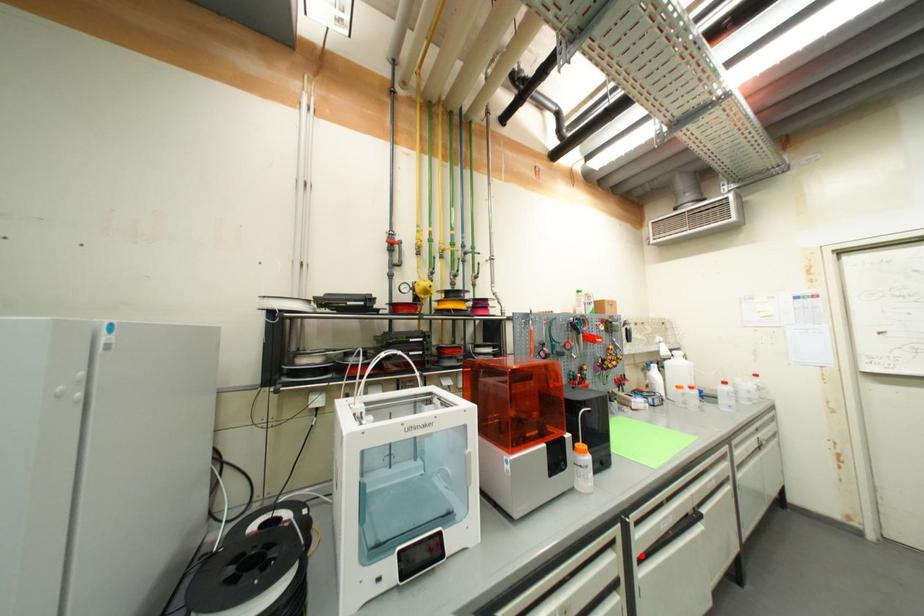
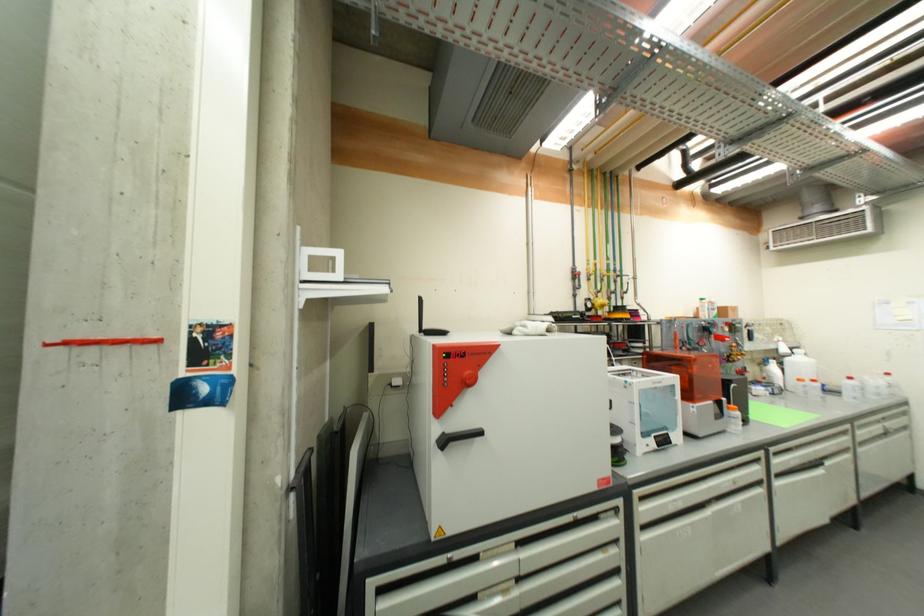
Question: I am providing you with two images of the same scene from different viewpoints. In image1, a red point is highlighted. Considering the same 3D point in image2, which of the following is correct?

Choices:
 (A) It is closer
 (B) It is farther

Answer: (A)